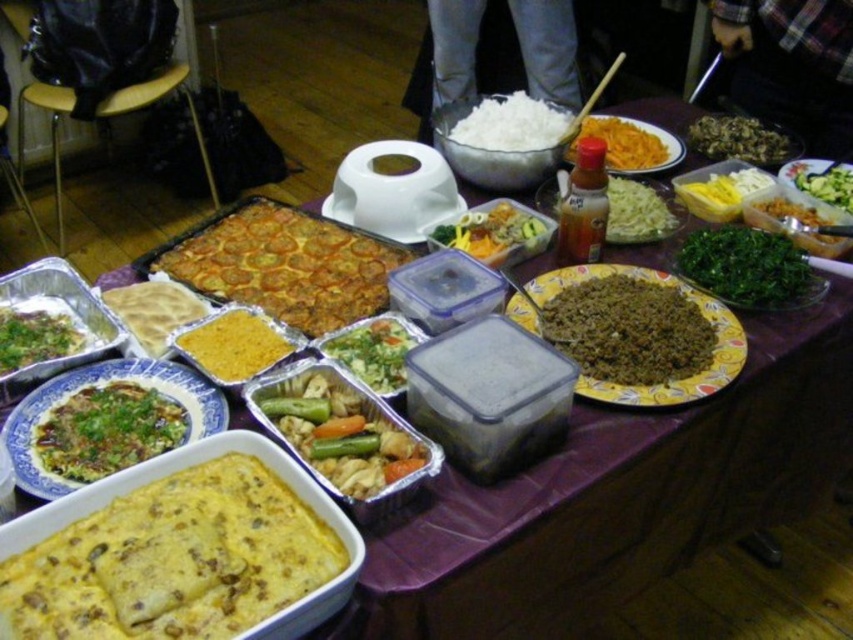
You are a guest at the table and want to reach for the yellow translucent plastic container at upper right. Is it directly above the yellow creamy rice at center?

Yes, the yellow translucent plastic container at upper right is directly above the yellow creamy rice at center.

You are a guest at the table and want to grab both the green matte salad at center and the translucent plastic bottle at center. Which one do you need to pick up first if you want to reach the one that is closer to you?

The green matte salad at center is smaller than the translucent plastic bottle at center, so you should pick up the green matte salad at center first since it requires less space to handle.